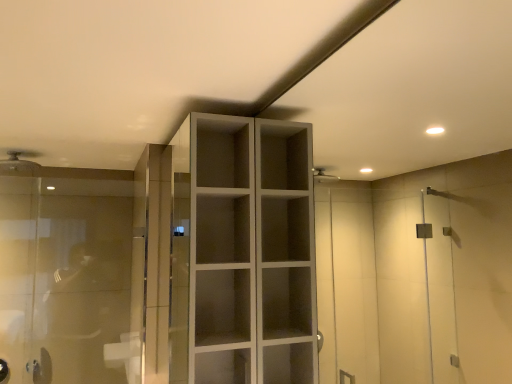
Question: Does matte white shower head at upper left have a larger size compared to matte white cupboard at center?

Choices:
 (A) yes
 (B) no

Answer: (B)

Question: Would you consider matte white shower head at upper left to be distant from matte white cupboard at center?

Choices:
 (A) yes
 (B) no

Answer: (A)

Question: From a real-world perspective, is matte white shower head at upper left on matte white cupboard at center?

Choices:
 (A) no
 (B) yes

Answer: (B)

Question: From the image's perspective, is matte white shower head at upper left located above matte white cupboard at center?

Choices:
 (A) no
 (B) yes

Answer: (B)

Question: Is matte white shower head at upper left wider than matte white cupboard at center?

Choices:
 (A) no
 (B) yes

Answer: (B)

Question: Is matte white shower head at upper left located outside matte white cupboard at center?

Choices:
 (A) yes
 (B) no

Answer: (A)

Question: Considering the relative sizes of transparent glass door at left and matte white shower head at upper left in the image provided, is transparent glass door at left bigger than matte white shower head at upper left?

Choices:
 (A) no
 (B) yes

Answer: (B)

Question: Would you say transparent glass door at left contains matte white shower head at upper left?

Choices:
 (A) no
 (B) yes

Answer: (A)

Question: Is transparent glass door at left not near matte white shower head at upper left?

Choices:
 (A) no
 (B) yes

Answer: (A)

Question: Is transparent glass door at left further to the viewer compared to matte white shower head at upper left?

Choices:
 (A) no
 (B) yes

Answer: (A)

Question: From a real-world perspective, is transparent glass door at left positioned over matte white shower head at upper left based on gravity?

Choices:
 (A) no
 (B) yes

Answer: (A)

Question: Is transparent glass door at left to the left of matte white shower head at upper left from the viewer's perspective?

Choices:
 (A) no
 (B) yes

Answer: (A)

Question: Does transparent glass door at left have a lesser width compared to matte white cupboard at center?

Choices:
 (A) no
 (B) yes

Answer: (B)